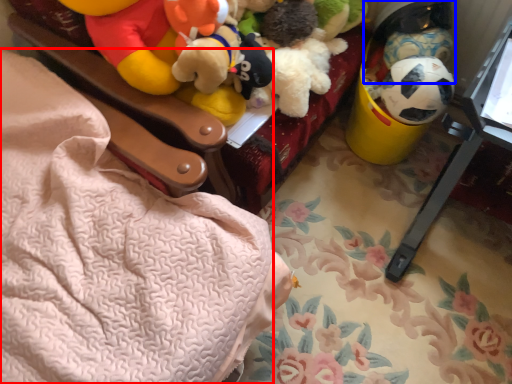
Question: Which point is closer to the camera, blanket (highlighted by a red box) or toy (highlighted by a blue box)?

Choices:
 (A) blanket
 (B) toy

Answer: (A)